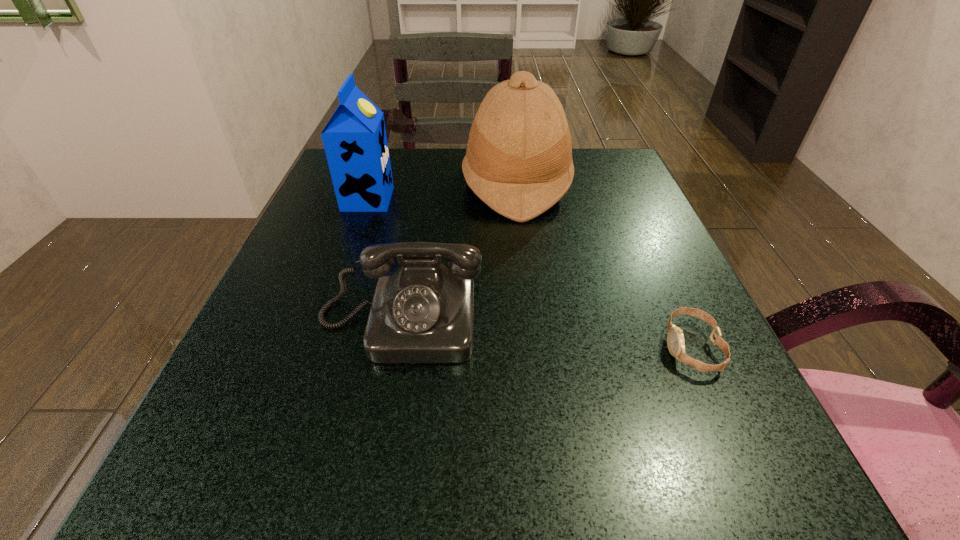
Find the location of a particular element. This screenshot has width=960, height=540. object situated at the far right corner is located at coordinates (518, 161).

Where is `free space at the far edge of the desktop`? The image size is (960, 540). free space at the far edge of the desktop is located at coordinates (456, 159).

In the image, there is a desktop. Identify the location of vacant space at the near edge. (412, 497).

In the image, there is a desktop. At what (x,y) coordinates should I click in order to perform the action: click on vacant space at the left edge. Please return your answer as a coordinate pair (x, y). This screenshot has width=960, height=540. Looking at the image, I should click on (376, 230).

Identify the location of vacant space at the right edge. Image resolution: width=960 pixels, height=540 pixels. (751, 428).

In the image, there is a desktop. Identify the location of vacant space at the near left corner. The height and width of the screenshot is (540, 960). (196, 464).

Find the location of a particular element. vacant space that is in between the hat and the watch is located at coordinates (604, 266).

The height and width of the screenshot is (540, 960). Find the location of `vacant space in between the shortest object and the carton`. vacant space in between the shortest object and the carton is located at coordinates (530, 273).

Locate an element on the screen. This screenshot has height=540, width=960. vacant region between the shortest object and the hat is located at coordinates click(604, 266).

Locate an element on the screen. The width and height of the screenshot is (960, 540). empty space between the hat and the carton is located at coordinates (443, 192).